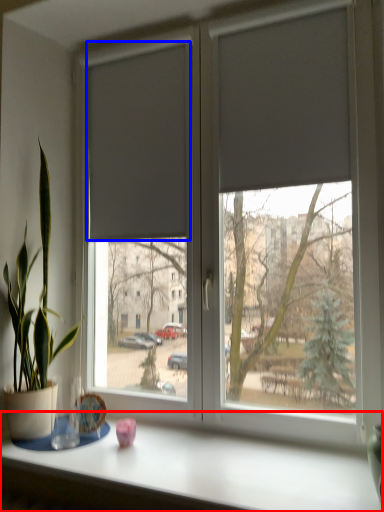
Question: Which object appears farthest to the camera in this image, table (highlighted by a red box) or curtain (highlighted by a blue box)?

Choices:
 (A) table
 (B) curtain

Answer: (B)